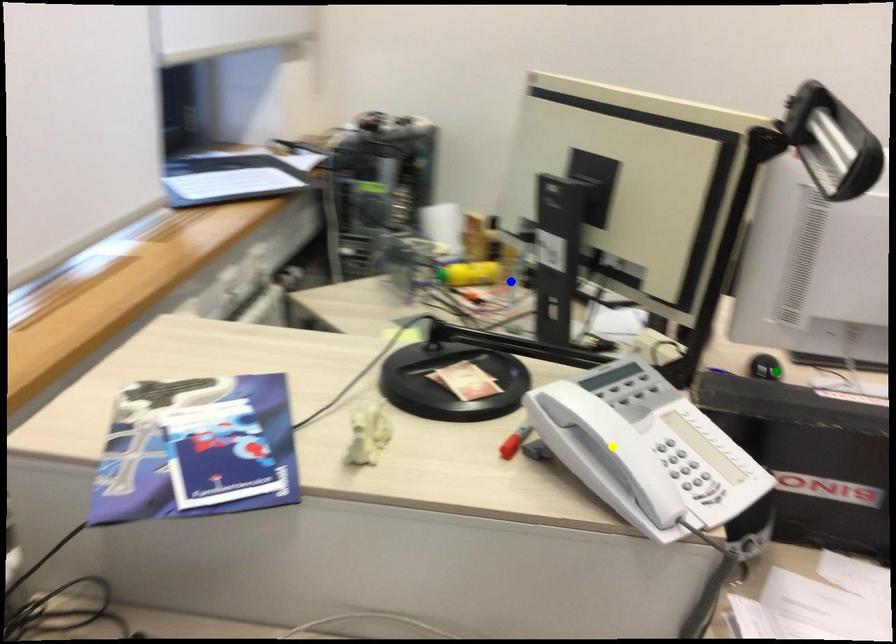
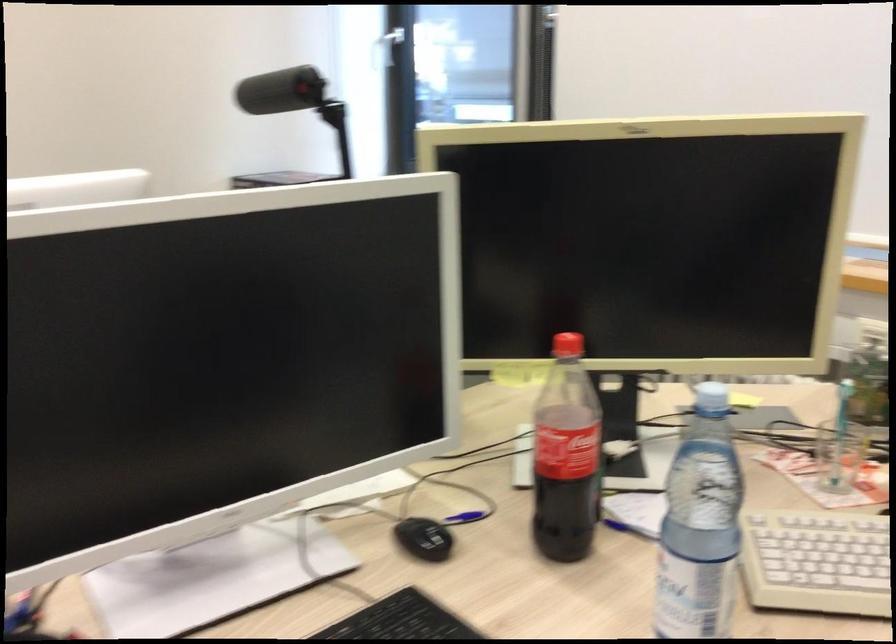
I am providing you with two images of the same scene from different viewpoints. Three points are marked in image1. Which point corresponds to a part or object that is occluded in image2?In image1, three points are marked. Which of them correspond to a part or object that is occluded in image2?Among the three points shown in image1, which one corresponds to a part or object that is no longer visible due to occlusion in image2?

yellow point cannot be seen in image2.